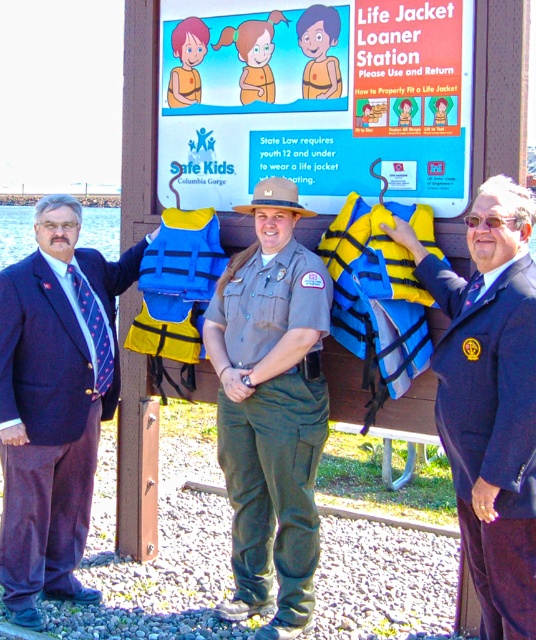
Does matte plastic sign at upper center appear over khaki uniform at center?

Correct, matte plastic sign at upper center is located above khaki uniform at center.

Does matte plastic sign at upper center lie behind khaki uniform at center?

That is False.

At what (x,y) coordinates should I click in order to perform the action: click on matte plastic sign at upper center. Please return your answer as a coordinate pair (x, y). Image resolution: width=536 pixels, height=640 pixels. Looking at the image, I should click on (316, 99).

Is matte plastic sign at upper center smaller than yellow fabric life jacket at center?

Actually, matte plastic sign at upper center might be larger than yellow fabric life jacket at center.

Can you confirm if matte plastic sign at upper center is wider than yellow fabric life jacket at center?

Indeed, matte plastic sign at upper center has a greater width compared to yellow fabric life jacket at center.

Who is more distant from viewer, (170,99) or (337,305)?

Point (170,99)

Where is `matte plastic sign at upper center`? The width and height of the screenshot is (536, 640). matte plastic sign at upper center is located at coordinates (316, 99).

Can you confirm if khaki uniform at center is positioned below orange life jacket at center?

Correct, khaki uniform at center is located below orange life jacket at center.

Between khaki uniform at center and orange life jacket at center, which one appears on the left side from the viewer's perspective?

orange life jacket at center

Measure the distance between point (240, 545) and camera.

Point (240, 545) is 14.01 feet from camera.

This screenshot has width=536, height=640. Find the location of `khaki uniform at center`. khaki uniform at center is located at coordinates (271, 408).